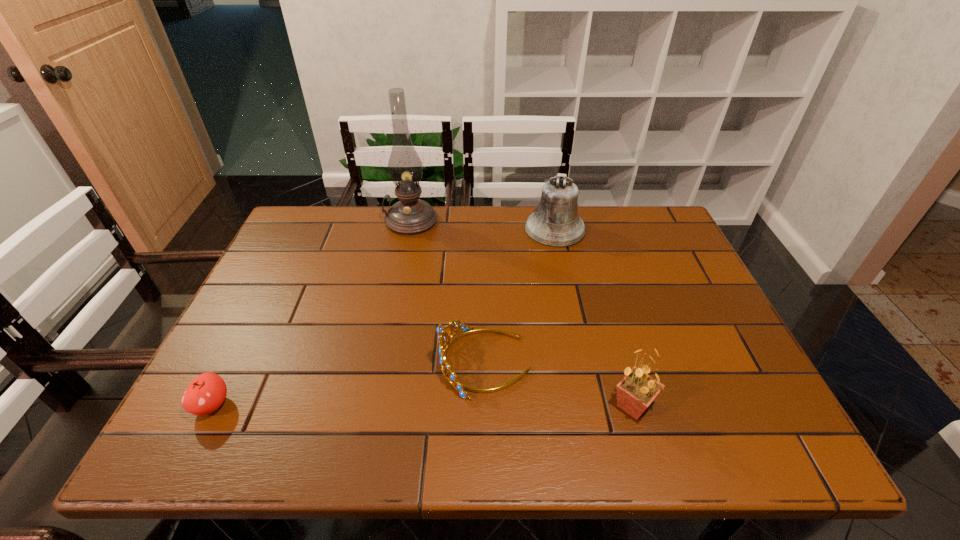
Choose which object is the third nearest neighbor to the oil lamp. Please provide its 2D coordinates. Your answer should be formatted as a tuple, i.e. [(x, y)], where the tuple contains the x and y coordinates of a point satisfying the conditions above.

[(206, 393)]

Image resolution: width=960 pixels, height=540 pixels. What are the coordinates of `object that ranks as the third closest to the bell` in the screenshot? It's located at (635, 392).